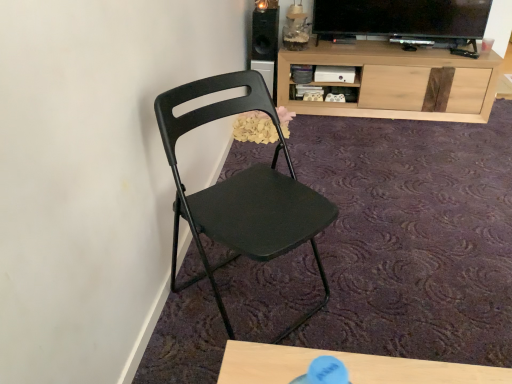
What do you see at coordinates (398, 82) in the screenshot? This screenshot has width=512, height=384. I see `light wood cabinet at upper right` at bounding box center [398, 82].

The width and height of the screenshot is (512, 384). Describe the element at coordinates (265, 34) in the screenshot. I see `black matte speaker at upper center` at that location.

What is the approximate height of black matte speaker at upper center?

black matte speaker at upper center is 11.87 inches tall.

What is the approximate width of matte black folding chair at center?

matte black folding chair at center is 19.47 inches wide.

Identify the location of light wood cabinet at upper right. (398, 82).

From a real-world perspective, is black matte speaker at upper center physically below light wood cabinet at upper right?

No, from a real-world perspective, black matte speaker at upper center is not beneath light wood cabinet at upper right.

From the picture: Is black matte speaker at upper center not near light wood cabinet at upper right?

They are positioned close to each other.

Is black matte speaker at upper center positioned beyond the bounds of light wood cabinet at upper right?

Absolutely, black matte speaker at upper center is external to light wood cabinet at upper right.

Considering the positions of objects black matte speaker at upper center and light wood cabinet at upper right in the image provided, who is behind, black matte speaker at upper center or light wood cabinet at upper right?

Positioned behind is black matte speaker at upper center.

Is matte black folding chair at center further to camera compared to black matte speaker at upper center?

No.

Consider the image. Does matte black folding chair at center have a greater width compared to black matte speaker at upper center?

Correct, the width of matte black folding chair at center exceeds that of black matte speaker at upper center.

Considering the sizes of objects matte black folding chair at center and black matte speaker at upper center in the image provided, who is bigger, matte black folding chair at center or black matte speaker at upper center?

Answer: matte black folding chair at center is bigger.

Would you say black matte speaker at upper center is part of matte black folding chair at center's contents?

Definitely not — black matte speaker at upper center is not inside matte black folding chair at center.

From a real-world perspective, which is physically below, matte black folding chair at center or light wood cabinet at upper right?

In real-world perspective, light wood cabinet at upper right is lower.

From the image's perspective, who appears lower, matte black folding chair at center or light wood cabinet at upper right?

From the image's view, matte black folding chair at center is below.

Is matte black folding chair at center to the left of light wood cabinet at upper right from the viewer's perspective?

Correct, you'll find matte black folding chair at center to the left of light wood cabinet at upper right.

How far apart are matte black folding chair at center and light wood cabinet at upper right?

A distance of 1.62 meters exists between matte black folding chair at center and light wood cabinet at upper right.

From a real-world perspective, which object stands above the other?

From a 3D spatial view, matte black folding chair at center is above.

From the image's perspective, is light wood cabinet at upper right located above or below matte black folding chair at center?

light wood cabinet at upper right is situated higher than matte black folding chair at center in the image.

Can you tell me how much light wood cabinet at upper right and matte black folding chair at center differ in facing direction?

There is a 54.4-degree angle between the facing directions of light wood cabinet at upper right and matte black folding chair at center.

Is light wood cabinet at upper right not within black matte speaker at upper center?

Yes, light wood cabinet at upper right is outside of black matte speaker at upper center.

From the image's perspective, which object appears higher, light wood cabinet at upper right or black matte speaker at upper center?

From the image's view, black matte speaker at upper center is above.

Which point is more forward, [362,75] or [258,34]?

The point [362,75] is more forward.

Can you tell me how much light wood cabinet at upper right and black matte speaker at upper center differ in facing direction?

2.27 degrees separate the facing orientations of light wood cabinet at upper right and black matte speaker at upper center.

Where is `chair on the left of black matte speaker at upper center`? The image size is (512, 384). chair on the left of black matte speaker at upper center is located at coordinates (242, 190).

From a real-world perspective, which is physically below, black matte speaker at upper center or matte black folding chair at center?

matte black folding chair at center is physically lower.

In the image, is black matte speaker at upper center on the left side or the right side of matte black folding chair at center?

In the image, black matte speaker at upper center appears on the right side of matte black folding chair at center.

Who is shorter, black matte speaker at upper center or matte black folding chair at center?

black matte speaker at upper center is shorter.

The height and width of the screenshot is (384, 512). I want to click on speaker above the light wood cabinet at upper right (from a real-world perspective), so click(265, 34).

Locate an element on the screen. This screenshot has width=512, height=384. chair that appears below the black matte speaker at upper center (from a real-world perspective) is located at coordinates (242, 190).

From the image, which object appears to be farther from matte black folding chair at center, light wood cabinet at upper right or black matte speaker at upper center?

black matte speaker at upper center is further to matte black folding chair at center.

In the scene shown: Which object lies nearer to the anchor point black matte speaker at upper center, light wood cabinet at upper right or matte black folding chair at center?

The object closer to black matte speaker at upper center is light wood cabinet at upper right.

Looking at the image, which one is located closer to light wood cabinet at upper right, matte black folding chair at center or black matte speaker at upper center?

black matte speaker at upper center.

Looking at the image, which one is located further to matte black folding chair at center, black matte speaker at upper center or light wood cabinet at upper right?

Result: black matte speaker at upper center is further to matte black folding chair at center.

When comparing their distances from light wood cabinet at upper right, does black matte speaker at upper center or matte black folding chair at center seem further?

Among the two, matte black folding chair at center is located further to light wood cabinet at upper right.

Which object lies further to the anchor point black matte speaker at upper center, matte black folding chair at center or light wood cabinet at upper right?

Among the two, matte black folding chair at center is located further to black matte speaker at upper center.

Locate an element on the screen. cabinetry between matte black folding chair at center and black matte speaker at upper center from front to back is located at coordinates (398, 82).